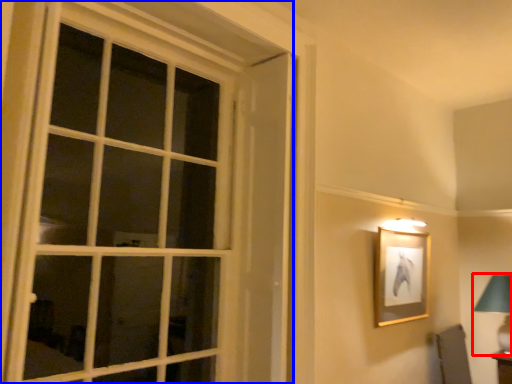
Question: Which object is further to the camera taking this photo, bedside lamp (highlighted by a red box) or window (highlighted by a blue box)?

Choices:
 (A) bedside lamp
 (B) window

Answer: (A)